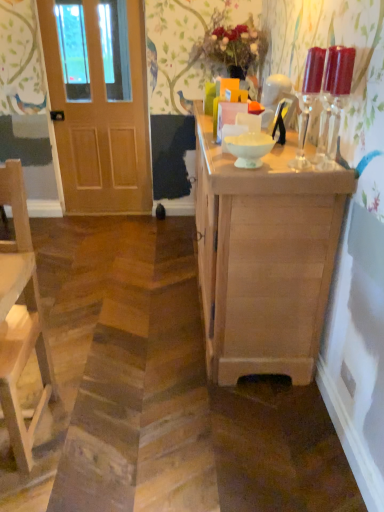
The image size is (384, 512). In order to click on natural wood cabinet at center in this screenshot , I will do `click(264, 258)`.

This screenshot has height=512, width=384. What do you see at coordinates (100, 117) in the screenshot? I see `wooden door at left` at bounding box center [100, 117].

Image resolution: width=384 pixels, height=512 pixels. Describe the element at coordinates (335, 94) in the screenshot. I see `translucent glass candle holders at upper right, which appears as the 1th candle holder when viewed from the right` at that location.

At what (x,y) coordinates should I click in order to perform the action: click on natural wood cabinet at center. Please return your answer as a coordinate pair (x, y). Image resolution: width=384 pixels, height=512 pixels. Looking at the image, I should click on (264, 258).

Which is behind, point (344, 83) or point (327, 268)?

Point (327, 268)

Between translucent glass candle holders at upper right, acting as the second candle holder starting from the left, and natural wood cabinet at center, which one has larger size?

With larger size is natural wood cabinet at center.

From a real-world perspective, which is physically below, translucent glass candle holders at upper right, which appears as the 1th candle holder when viewed from the right, or natural wood cabinet at center?

natural wood cabinet at center, from a real-world perspective.

Can you see translucent glass candle holders at upper right, acting as the second candle holder starting from the left, touching natural wood cabinet at center?

No.

From the image's perspective, which is below, wooden door at left or white glossy bowl at center?

white glossy bowl at center is shown below in the image.

Measure the distance from wooden door at left to white glossy bowl at center.

wooden door at left and white glossy bowl at center are 7.76 feet apart from each other.

Is wooden door at left directly adjacent to white glossy bowl at center?

There is a gap between wooden door at left and white glossy bowl at center.

Is wooden door at left to the left of white glossy bowl at center from the viewer's perspective?

Indeed, wooden door at left is positioned on the left side of white glossy bowl at center.

Can you confirm if light brown wooden chair at left is taller than wooden door at left?

In fact, light brown wooden chair at left may be shorter than wooden door at left.

Is light brown wooden chair at left oriented away from wooden door at left?

Yes, light brown wooden chair at left's orientation is away from wooden door at left.

Is light brown wooden chair at left not within wooden door at left?

That's correct, light brown wooden chair at left is outside of wooden door at left.

In the scene shown: From the image's perspective, which is above, light brown wooden chair at left or wooden door at left?

wooden door at left is shown above in the image.

Considering the sizes of translucent glass candle holders at upper right, which appears as the 1th candle holder when viewed from the right, and white glossy bowl at center in the image, is translucent glass candle holders at upper right, which appears as the 1th candle holder when viewed from the right, wider or thinner than white glossy bowl at center?

In the image, translucent glass candle holders at upper right, which appears as the 1th candle holder when viewed from the right, appears to be more narrow than white glossy bowl at center.

Which object is further away from the camera, translucent glass candle holders at upper right, which appears as the 1th candle holder when viewed from the right, or white glossy bowl at center?

white glossy bowl at center.

Which of these two, translucent glass candle holders at upper right, which appears as the 1th candle holder when viewed from the right, or white glossy bowl at center, is bigger?

Bigger between the two is white glossy bowl at center.

Measure the distance between translucent glass candle holders at upper right, which appears as the 1th candle holder when viewed from the right, and white glossy bowl at center.

34.40 centimeters.

How many degrees apart are the facing directions of clear glass candle holders at upper right, the 2th candle holder viewed from the right, and light brown wooden chair at left?

The angular difference between clear glass candle holders at upper right, the 2th candle holder viewed from the right, and light brown wooden chair at left is 91.1 degrees.

Is clear glass candle holders at upper right, which ranks as the 1th candle holder in left-to-right order, to the right of light brown wooden chair at left from the viewer's perspective?

Correct, you'll find clear glass candle holders at upper right, which ranks as the 1th candle holder in left-to-right order, to the right of light brown wooden chair at left.

Is clear glass candle holders at upper right, which ranks as the 1th candle holder in left-to-right order, wider or thinner than light brown wooden chair at left?

Considering their sizes, clear glass candle holders at upper right, which ranks as the 1th candle holder in left-to-right order, looks slimmer than light brown wooden chair at left.

From a real-world perspective, which is physically below, clear glass candle holders at upper right, the 2th candle holder viewed from the right, or light brown wooden chair at left?

light brown wooden chair at left.

Is point (100, 117) positioned in front of point (3, 362)?

No, it is not.

Can you confirm if wooden door at left is taller than light brown wooden chair at left?

Correct, wooden door at left is much taller as light brown wooden chair at left.

Is wooden door at left wider than light brown wooden chair at left?

Incorrect, the width of wooden door at left does not surpass that of light brown wooden chair at left.

Which is behind, wooden door at left or light brown wooden chair at left?

wooden door at left is further away from the camera.

Would you consider wooden door at left to be distant from clear glass candle holders at upper right, the 2th candle holder viewed from the right?

wooden door at left is positioned a significant distance from clear glass candle holders at upper right, the 2th candle holder viewed from the right.

Considering the relative sizes of wooden door at left and clear glass candle holders at upper right, which ranks as the 1th candle holder in left-to-right order, in the image provided, is wooden door at left taller than clear glass candle holders at upper right, which ranks as the 1th candle holder in left-to-right order,?

Indeed, wooden door at left has a greater height compared to clear glass candle holders at upper right, which ranks as the 1th candle holder in left-to-right order.

Which is correct: wooden door at left is inside clear glass candle holders at upper right, which ranks as the 1th candle holder in left-to-right order, or outside of it?

wooden door at left exists outside the volume of clear glass candle holders at upper right, which ranks as the 1th candle holder in left-to-right order.

Considering the positions of objects wooden door at left and clear glass candle holders at upper right, the 2th candle holder viewed from the right, in the image provided, who is more to the right, wooden door at left or clear glass candle holders at upper right, the 2th candle holder viewed from the right,?

Positioned to the right is clear glass candle holders at upper right, the 2th candle holder viewed from the right.

Identify the location of cabinetry on the left of translucent glass candle holders at upper right, which appears as the 1th candle holder when viewed from the right. (264, 258).

I want to click on door lying behind the white glossy bowl at center, so click(100, 117).

When comparing their distances from wooden door at left, does natural wood cabinet at center or translucent glass candle holders at upper right, which appears as the 1th candle holder when viewed from the right, seem closer?

natural wood cabinet at center.

When comparing their distances from light brown wooden chair at left, does clear glass candle holders at upper right, the 2th candle holder viewed from the right, or wooden door at left seem further?

The object further to light brown wooden chair at left is wooden door at left.

Which object lies further to the anchor point light brown wooden chair at left, translucent glass candle holders at upper right, which appears as the 1th candle holder when viewed from the right, or white glossy bowl at center?

translucent glass candle holders at upper right, which appears as the 1th candle holder when viewed from the right, is positioned further to the anchor light brown wooden chair at left.

Considering their positions, is light brown wooden chair at left positioned closer to clear glass candle holders at upper right, the 2th candle holder viewed from the right, than translucent glass candle holders at upper right, which appears as the 1th candle holder when viewed from the right?

translucent glass candle holders at upper right, which appears as the 1th candle holder when viewed from the right, is positioned closer to the anchor clear glass candle holders at upper right, the 2th candle holder viewed from the right.

Estimate the real-world distances between objects in this image. Which object is further from light brown wooden chair at left, white glossy bowl at center or wooden door at left?

Among the two, wooden door at left is located further to light brown wooden chair at left.

From the image, which object appears to be farther from translucent glass candle holders at upper right, which appears as the 1th candle holder when viewed from the right, clear glass candle holders at upper right, which ranks as the 1th candle holder in left-to-right order, or light brown wooden chair at left?

light brown wooden chair at left is further to translucent glass candle holders at upper right, which appears as the 1th candle holder when viewed from the right.

Based on their spatial positions, is light brown wooden chair at left or natural wood cabinet at center closer to white glossy bowl at center?

natural wood cabinet at center lies closer to white glossy bowl at center than the other object.

Estimate the real-world distances between objects in this image. Which object is closer to translucent glass candle holders at upper right, which appears as the 1th candle holder when viewed from the right, clear glass candle holders at upper right, the 2th candle holder viewed from the right, or natural wood cabinet at center?

clear glass candle holders at upper right, the 2th candle holder viewed from the right.

You are a GUI agent. You are given a task and a screenshot of the screen. Output one action in this format:
    pyautogui.click(x=<x>, y=<y>)
    Task: Click on the cabinetry between light brown wooden chair at left and clear glass candle holders at upper right, which ranks as the 1th candle holder in left-to-right order
    The image size is (384, 512).
    Given the screenshot: What is the action you would take?
    pyautogui.click(x=264, y=258)

Find the location of a particular element. Image resolution: width=384 pixels, height=512 pixels. cabinetry between light brown wooden chair at left and translucent glass candle holders at upper right, acting as the second candle holder starting from the left, in the horizontal direction is located at coordinates (264, 258).

You are a GUI agent. You are given a task and a screenshot of the screen. Output one action in this format:
    pyautogui.click(x=<x>, y=<y>)
    Task: Click on the bowl between clear glass candle holders at upper right, which ranks as the 1th candle holder in left-to-right order, and natural wood cabinet at center from top to bottom
    
    Given the screenshot: What is the action you would take?
    pyautogui.click(x=249, y=148)

Find the location of a particular element. The width and height of the screenshot is (384, 512). candle holder located between light brown wooden chair at left and translucent glass candle holders at upper right, acting as the second candle holder starting from the left, in the left-right direction is located at coordinates (308, 101).